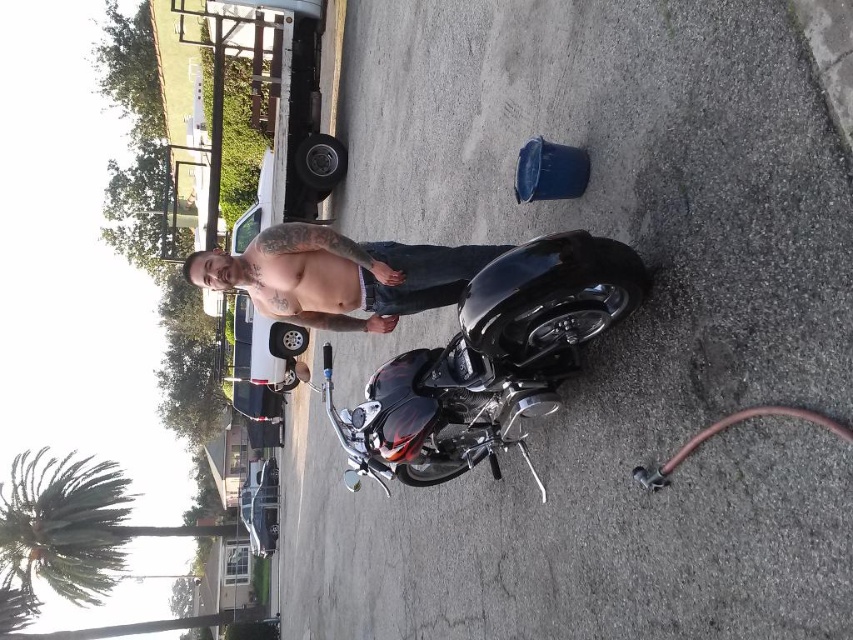
Looking at this image, between glossy black motorcycle at center and green leafy palm tree at lower left, which one is positioned lower?

green leafy palm tree at lower left is below.

Does glossy black motorcycle at center lie behind green leafy palm tree at lower left?

No, it is in front of green leafy palm tree at lower left.

The height and width of the screenshot is (640, 853). What do you see at coordinates (488, 362) in the screenshot?
I see `glossy black motorcycle at center` at bounding box center [488, 362].

I want to click on glossy black motorcycle at center, so click(488, 362).

Is point (90, 499) farther from camera compared to point (360, 266)?

Yes.

Who is positioned more to the right, green leafy palm tree at lower left or muscular skin at center?

From the viewer's perspective, muscular skin at center appears more on the right side.

What do you see at coordinates (61, 529) in the screenshot? The height and width of the screenshot is (640, 853). I see `green leafy palm tree at lower left` at bounding box center [61, 529].

Where is `green leafy palm tree at lower left`? The height and width of the screenshot is (640, 853). green leafy palm tree at lower left is located at coordinates (61, 529).

Is glossy black motorcycle at center wider than muscular skin at center?

Yes, glossy black motorcycle at center is wider than muscular skin at center.

Image resolution: width=853 pixels, height=640 pixels. Find the location of `glossy black motorcycle at center`. glossy black motorcycle at center is located at coordinates (488, 362).